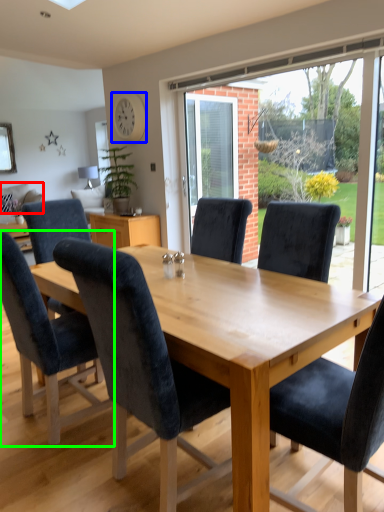
Question: Which object is positioned closest to pillow (highlighted by a red box)? Select from clock (highlighted by a blue box) and chair (highlighted by a green box).

Choices:
 (A) clock
 (B) chair

Answer: (A)